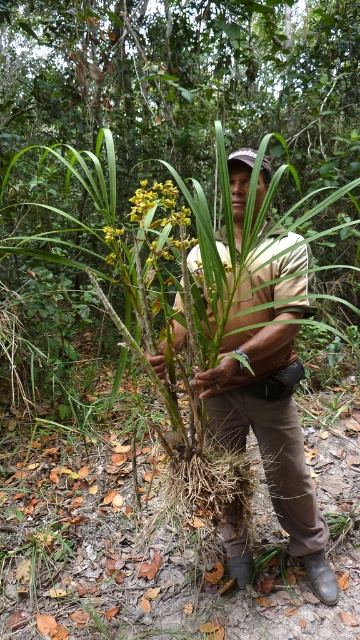
Question: Which point appears closest to the camera in this image?

Choices:
 (A) (239, 429)
 (B) (181, 211)

Answer: (B)

Question: Does brown leather boots at lower center lie in front of yellow-green textured flower at center?

Choices:
 (A) yes
 (B) no

Answer: (B)

Question: Where is brown leather boots at lower center located in relation to yellow-green textured flower at center in the image?

Choices:
 (A) left
 (B) right

Answer: (B)

Question: Is brown leather boots at lower center wider than yellow-green textured flower at center?

Choices:
 (A) yes
 (B) no

Answer: (A)

Question: Which point is farther to the camera?

Choices:
 (A) (167, 256)
 (B) (300, 284)

Answer: (A)